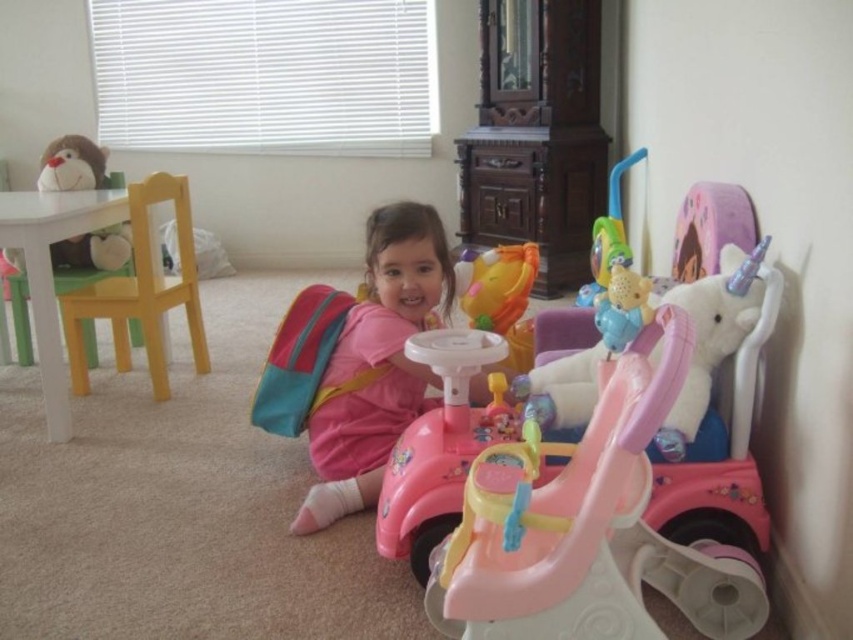
Question: Which point is closer to the camera?

Choices:
 (A) (387, 342)
 (B) (178, 177)
 (C) (51, 145)

Answer: (A)

Question: Is yellow matte chair at left further to camera compared to fluffy plush monkey at upper left?

Choices:
 (A) no
 (B) yes

Answer: (A)

Question: Is pink matte backpack at center thinner than yellow matte chair at left?

Choices:
 (A) yes
 (B) no

Answer: (A)

Question: Is pink matte backpack at center to the right of fluffy plush monkey at upper left from the viewer's perspective?

Choices:
 (A) yes
 (B) no

Answer: (A)

Question: Which of the following is the farthest from the observer?

Choices:
 (A) (413, 212)
 (B) (73, 182)
 (C) (76, 291)

Answer: (B)

Question: Which point is farther from the camera taking this photo?

Choices:
 (A) (112, 284)
 (B) (86, 156)
 (C) (318, 449)

Answer: (B)